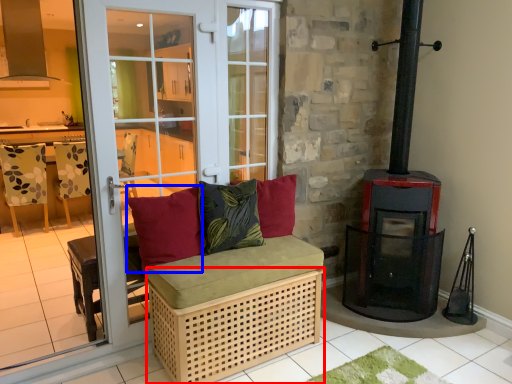
Question: Which object is closer to the camera taking this photo, crate (highlighted by a red box) or pillow (highlighted by a blue box)?

Choices:
 (A) crate
 (B) pillow

Answer: (A)